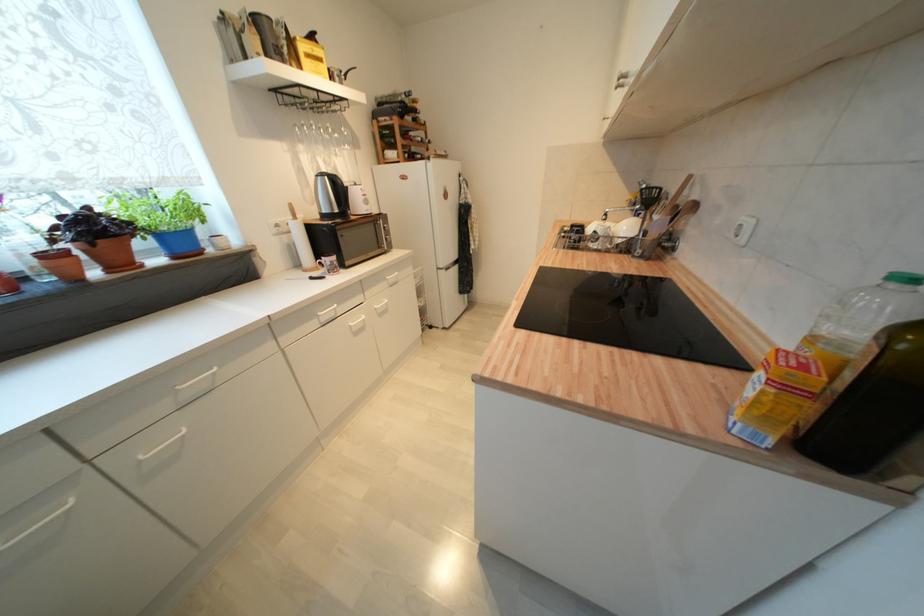
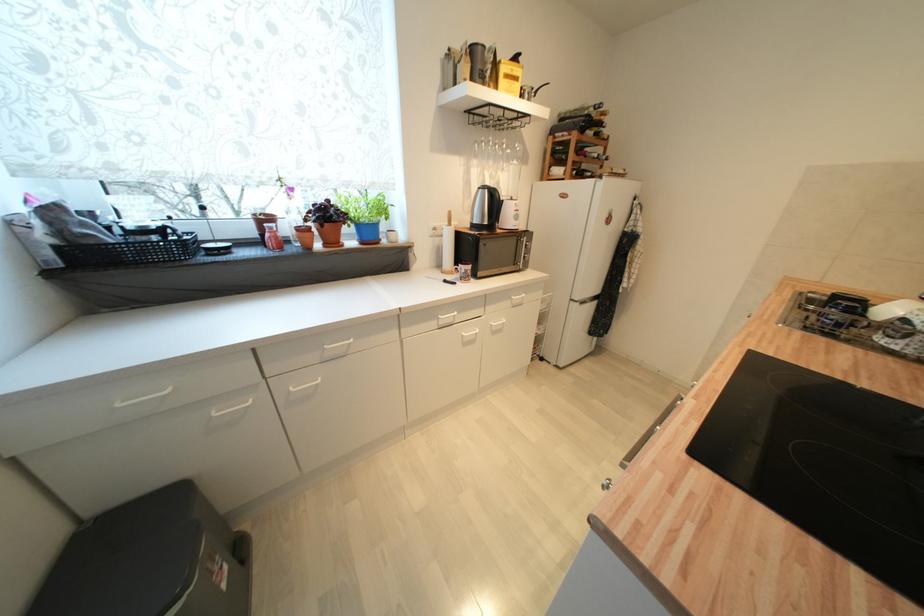
Find the pixel in the second image that matches (x=383, y=301) in the first image.

(502, 318)